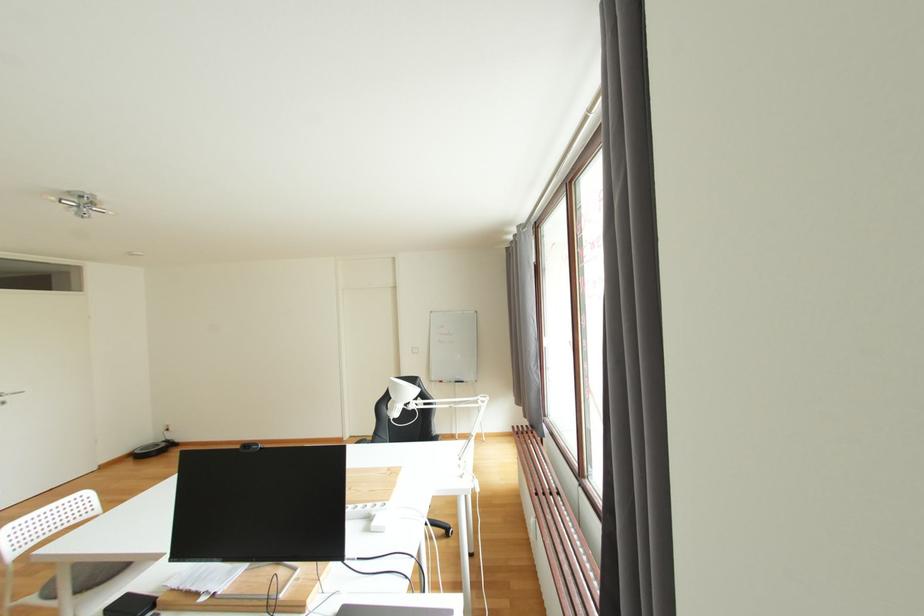
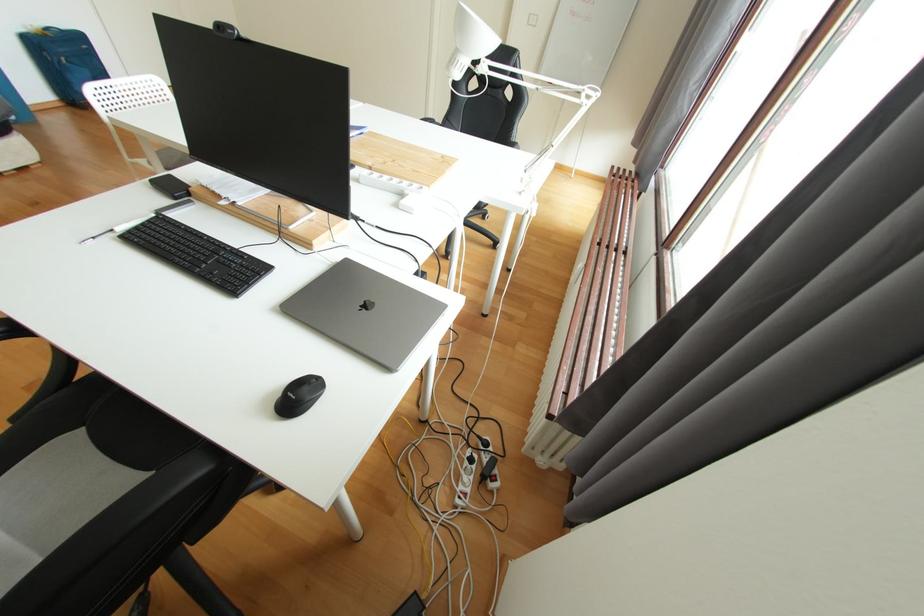
Question: How did the camera likely rotate?

Choices:
 (A) Left
 (B) Right
 (C) Up
 (D) Down

Answer: (D)